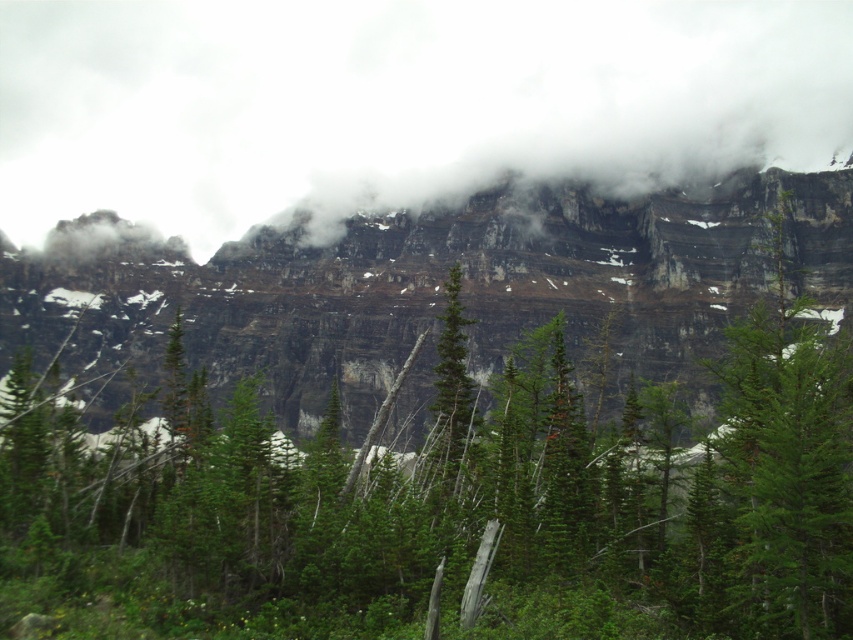
You are an airplane pilot flying over the mountainous landscape described in the scene. You notice a point marked at coordinates (396, 102). What object is located at this point?

The point at coordinates (396, 102) indicates a white fluffy cloud at upper center.

You are a hiker looking at the mountain scene. You notice the white fluffy cloud at upper center and the rocky cliff at upper center. Which one appears taller in the image?

The white fluffy cloud at upper center appears taller than the rocky cliff at upper center according to the description.